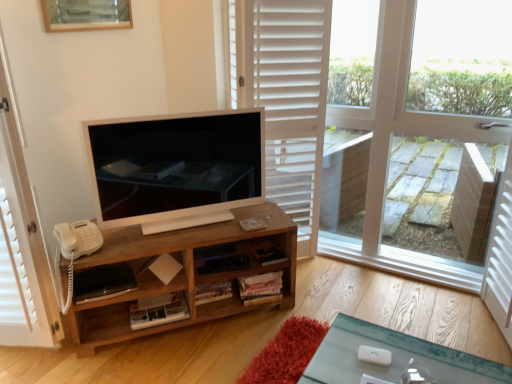
Question: From the image's perspective, is satin white television at center above white wooden screen door at right, the second screen door viewed from the left?

Choices:
 (A) yes
 (B) no

Answer: (A)

Question: Is satin white television at center further to camera compared to white wooden screen door at right, the second screen door viewed from the left?

Choices:
 (A) yes
 (B) no

Answer: (A)

Question: Can you confirm if satin white television at center is smaller than white wooden screen door at right, which ranks as the 1th screen door in right-to-left order?

Choices:
 (A) no
 (B) yes

Answer: (B)

Question: Is satin white television at center at the right side of white wooden screen door at right, which ranks as the 1th screen door in right-to-left order?

Choices:
 (A) yes
 (B) no

Answer: (B)

Question: Is satin white television at center at the left side of white wooden screen door at right, the second screen door viewed from the left?

Choices:
 (A) no
 (B) yes

Answer: (B)

Question: Are satin white television at center and white wooden screen door at right, the second screen door viewed from the left, making contact?

Choices:
 (A) no
 (B) yes

Answer: (A)

Question: Is white wooden screen door at right, the second screen door viewed from the left, at the left side of wooden picture frame at upper center?

Choices:
 (A) no
 (B) yes

Answer: (A)

Question: Can you confirm if white wooden screen door at right, the second screen door viewed from the left, is thinner than wooden picture frame at upper center?

Choices:
 (A) no
 (B) yes

Answer: (A)

Question: From a real-world perspective, is white wooden screen door at right, which ranks as the 1th screen door in right-to-left order, positioned under wooden picture frame at upper center based on gravity?

Choices:
 (A) no
 (B) yes

Answer: (B)

Question: Does white wooden screen door at right, which ranks as the 1th screen door in right-to-left order, turn towards wooden picture frame at upper center?

Choices:
 (A) no
 (B) yes

Answer: (B)

Question: Is white wooden screen door at right, the second screen door viewed from the left, shorter than wooden picture frame at upper center?

Choices:
 (A) no
 (B) yes

Answer: (A)

Question: Does white wooden screen door at right, which ranks as the 1th screen door in right-to-left order, have a larger size compared to wooden picture frame at upper center?

Choices:
 (A) yes
 (B) no

Answer: (A)

Question: Is wooden picture frame at upper center looking in the opposite direction of satin white television at center?

Choices:
 (A) yes
 (B) no

Answer: (B)